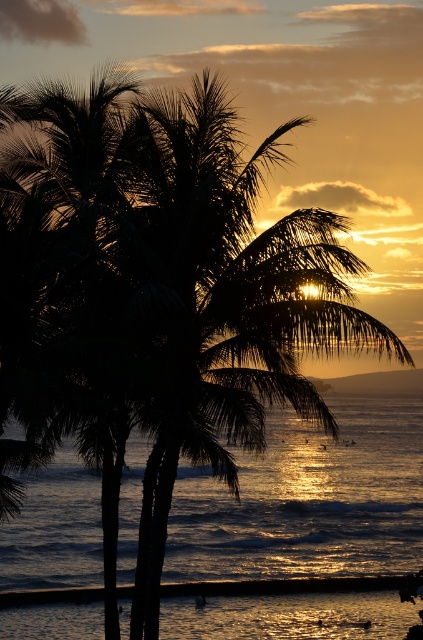
Between point (395, 404) and point (77, 600), which one is positioned behind?

Positioned behind is point (395, 404).

Does point (271, 515) come closer to viewer compared to point (29, 604)?

No.

Find the location of a particular element. shiny golden water at center is located at coordinates (307, 500).